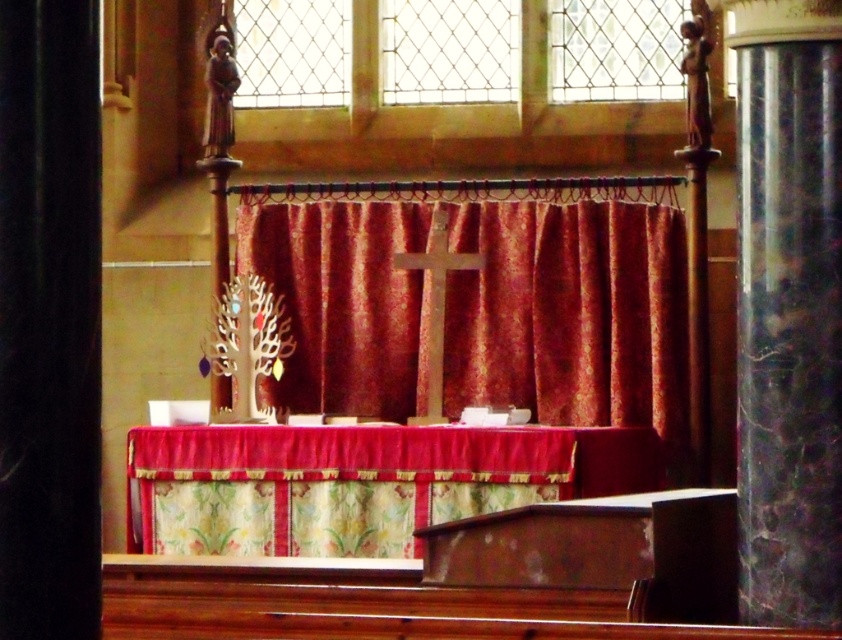
Question: Does marble column at right appear on the left side of clear glass lattice at upper center?

Choices:
 (A) yes
 (B) no

Answer: (B)

Question: Which object appears farthest from the camera in this image?

Choices:
 (A) marble column at right
 (B) clear glass lattice at upper center
 (C) clear glass window at upper center
 (D) velvet red curtain at center

Answer: (C)

Question: Which point is closer to the camera taking this photo?

Choices:
 (A) (x=475, y=81)
 (B) (x=741, y=193)
 (C) (x=398, y=26)

Answer: (B)

Question: Is clear glass at upper center below clear glass window at upper center?

Choices:
 (A) yes
 (B) no

Answer: (B)

Question: Which of the following is the closest to the observer?

Choices:
 (A) marble column at right
 (B) velvet red curtain at center
 (C) clear glass at upper center
 (D) clear glass window at upper center

Answer: (A)

Question: Does floral fabric table at center lie behind clear glass lattice at upper center?

Choices:
 (A) yes
 (B) no

Answer: (B)